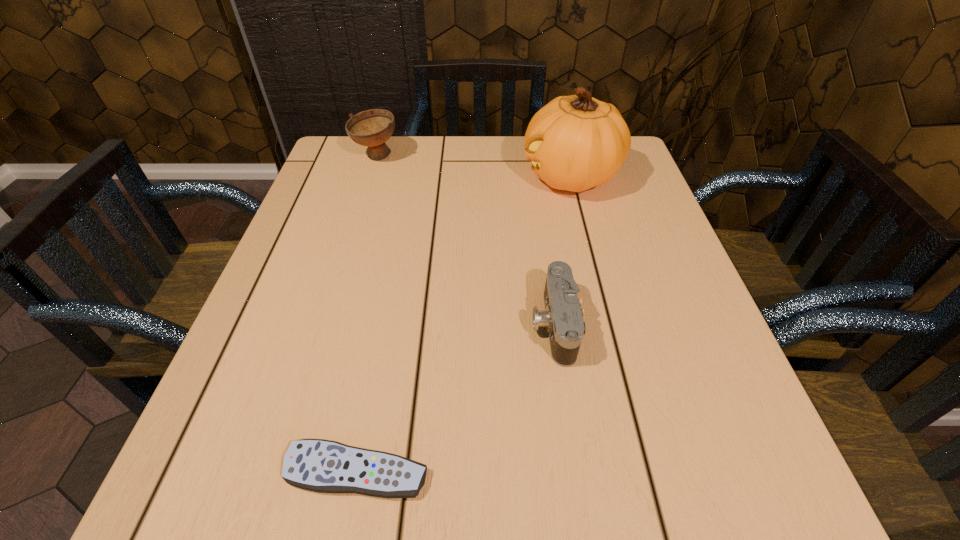
Where is `object located at the far left corner`? Image resolution: width=960 pixels, height=540 pixels. object located at the far left corner is located at coordinates (372, 128).

This screenshot has width=960, height=540. In order to click on object that is positioned at the near left corner in this screenshot , I will do `click(318, 465)`.

You are a GUI agent. You are given a task and a screenshot of the screen. Output one action in this format:
    pyautogui.click(x=<x>, y=<y>)
    Task: Click on the object present at the far right corner
    The image size is (960, 540).
    Given the screenshot: What is the action you would take?
    pyautogui.click(x=576, y=142)

This screenshot has height=540, width=960. In the image, there is a desktop. Identify the location of vacant region at the far edge. (396, 156).

Locate an element on the screen. This screenshot has width=960, height=540. vacant area at the near edge is located at coordinates (300, 502).

You are a GUI agent. You are given a task and a screenshot of the screen. Output one action in this format:
    pyautogui.click(x=<x>, y=<y>)
    Task: Click on the free point at the left edge
    This screenshot has height=540, width=960.
    Given the screenshot: What is the action you would take?
    pyautogui.click(x=344, y=204)

Locate an element on the screen. vacant space at the right edge is located at coordinates click(650, 217).

You are a GUI agent. You are given a task and a screenshot of the screen. Output one action in this format:
    pyautogui.click(x=<x>, y=<y>)
    Task: Click on the vacant point at the far left corner
    
    Given the screenshot: What is the action you would take?
    pyautogui.click(x=327, y=180)

Find the location of a particular element. Image resolution: width=960 pixels, height=540 pixels. free space at the near left corner is located at coordinates (189, 461).

At what (x,y) coordinates should I click in order to perform the action: click on blank area at the far right corner. Please return your answer as a coordinate pair (x, y). Looking at the image, I should click on (625, 161).